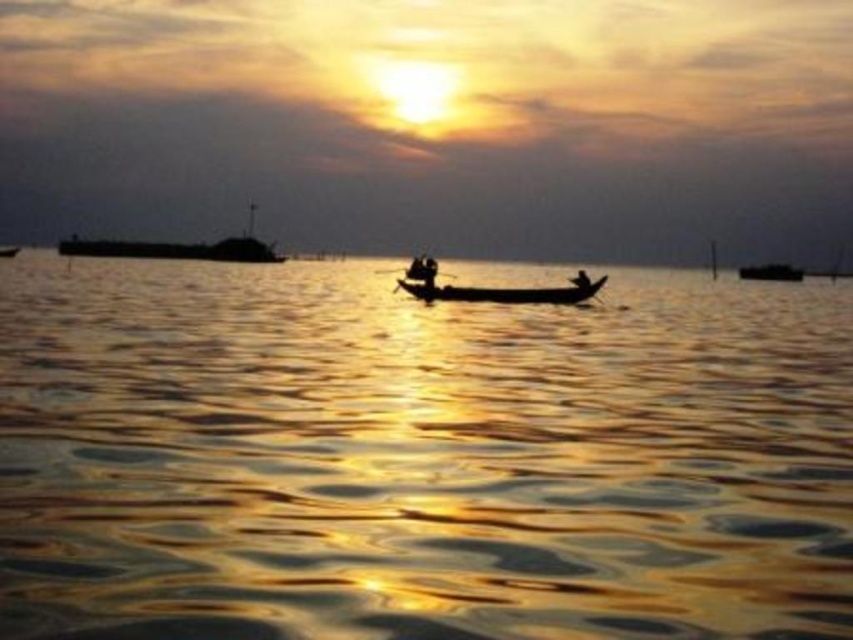
Between point (479, 291) and point (757, 276), which one is positioned in front?

Point (479, 291) is more forward.

Consider the image. Is smooth wood canoe at center below dark matte boat at center?

Correct, smooth wood canoe at center is located below dark matte boat at center.

Between point (488, 292) and point (775, 262), which one is positioned behind?

Point (775, 262)

Locate an element on the screen. The width and height of the screenshot is (853, 640). smooth wood canoe at center is located at coordinates (503, 292).

Who is positioned more to the right, dark gray metallic boat at left or black wood paddle at center?

Positioned to the right is black wood paddle at center.

In the scene shown: Is dark gray metallic boat at left smaller than black wood paddle at center?

No, dark gray metallic boat at left is not smaller than black wood paddle at center.

Is point (207, 248) farther from camera compared to point (421, 269)?

Yes.

You are a GUI agent. You are given a task and a screenshot of the screen. Output one action in this format:
    pyautogui.click(x=<x>, y=<y>)
    Task: Click on the dark gray metallic boat at left
    The height and width of the screenshot is (640, 853).
    Given the screenshot: What is the action you would take?
    (178, 248)

Between smooth wood canoe at center and smooth skin person at center, which one has less height?

With less height is smooth wood canoe at center.

Who is positioned more to the left, smooth wood canoe at center or smooth skin person at center?

From the viewer's perspective, smooth wood canoe at center appears more on the left side.

This screenshot has width=853, height=640. What are the coordinates of `smooth wood canoe at center` in the screenshot? It's located at (503, 292).